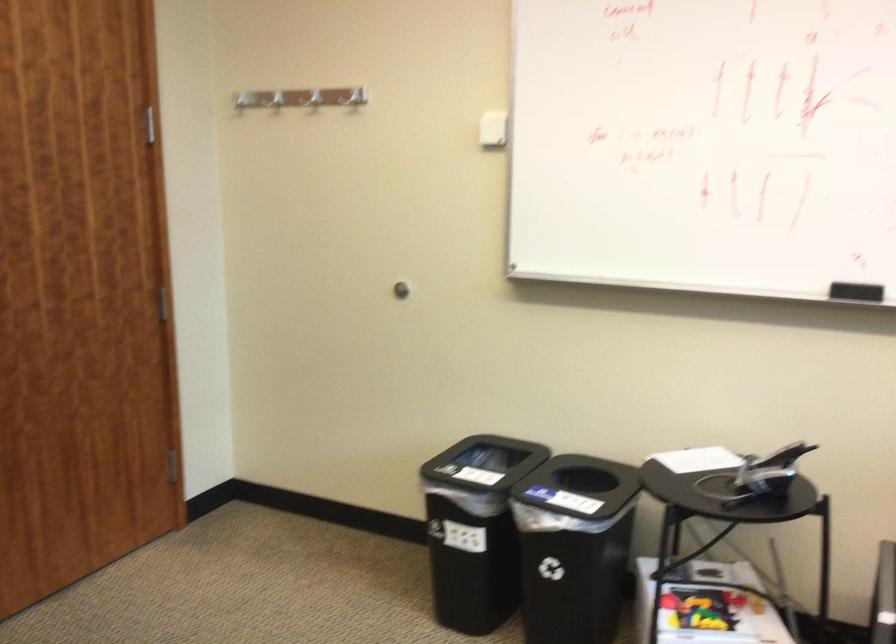
Describe the element at coordinates (782, 456) in the screenshot. I see `a telephone handset` at that location.